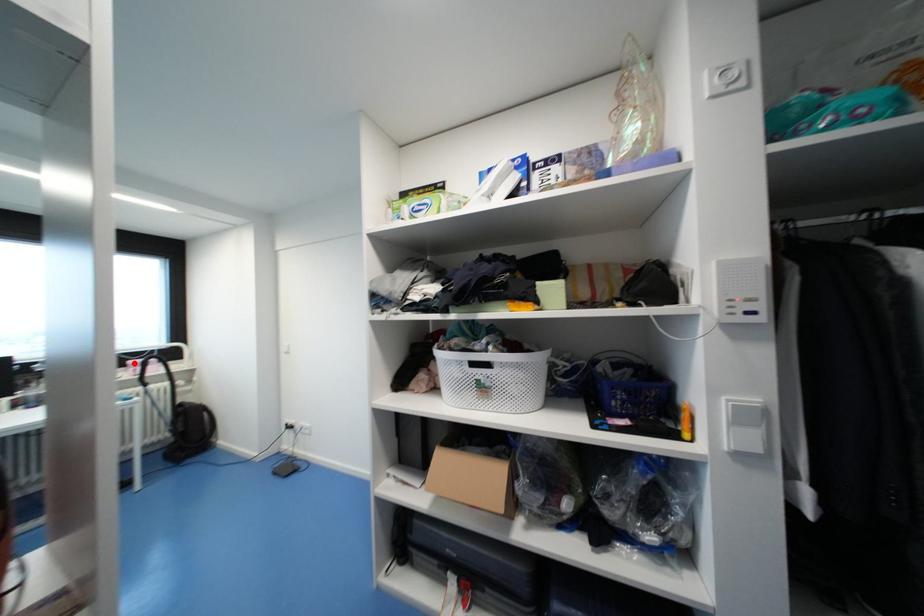
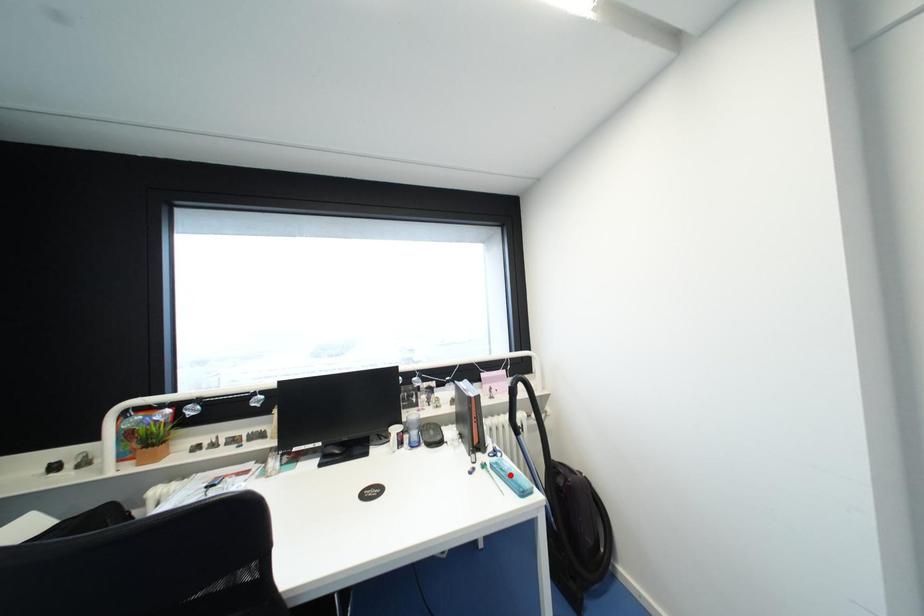
I am providing you with two images of the same scene from different viewpoints. A red point is marked on the first image and another point is marked on the second image. Does the point marked in image1 correspond to the same location as the one in image2?

No